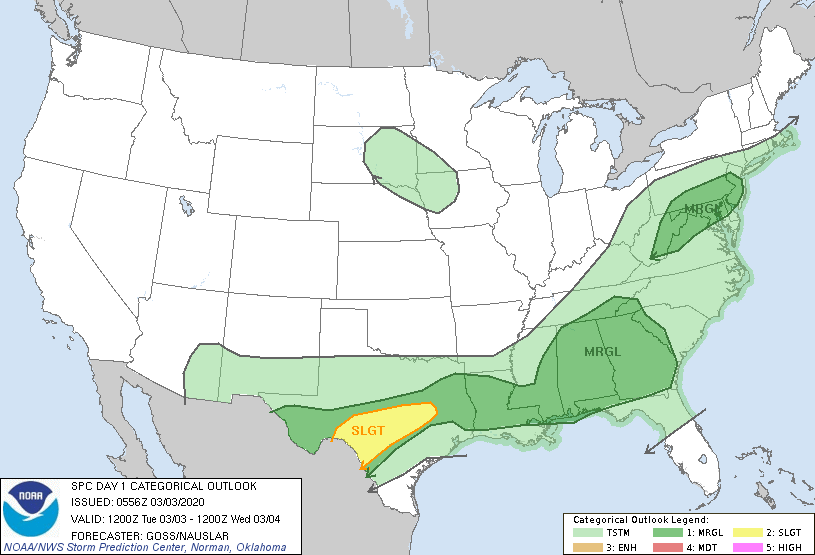
At what (x,y) coordinates should I click in order to perform the action: click on map. Please return your answer as a coordinate pair (x, y). The height and width of the screenshot is (555, 815). Looking at the image, I should click on (399, 226).